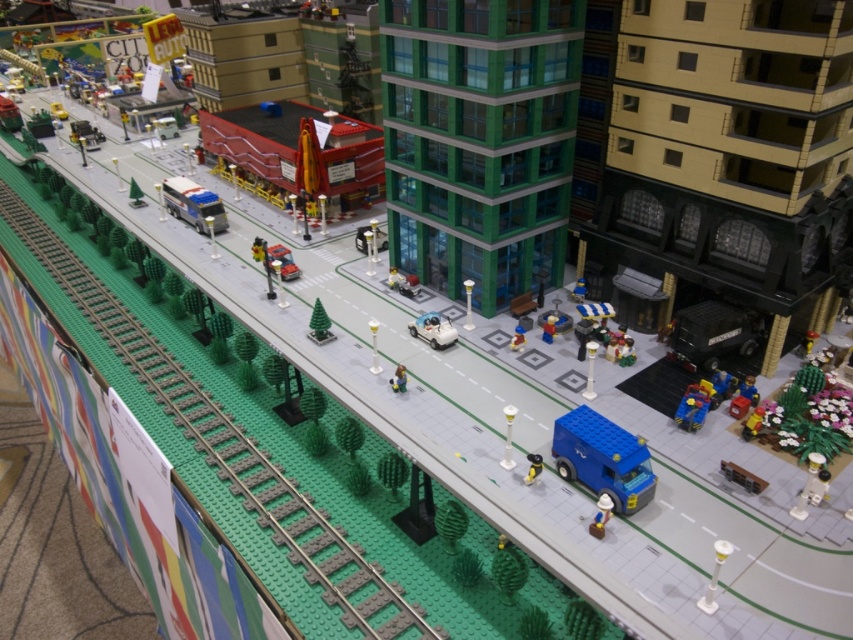
Can you confirm if shiny silver car at center is bigger than smooth gray figure at center?

Indeed, shiny silver car at center has a larger size compared to smooth gray figure at center.

Does shiny silver car at center appear on the right side of smooth gray figure at center?

Correct, you'll find shiny silver car at center to the right of smooth gray figure at center.

Between point (451, 330) and point (399, 374), which one is positioned behind?

Positioned behind is point (451, 330).

This screenshot has width=853, height=640. Identify the location of shiny silver car at center. (433, 330).

From the picture: Is green matte tree at center above brown matte hat at lower center?

Correct, green matte tree at center is located above brown matte hat at lower center.

Measure the distance between green matte tree at center and camera.

A distance of 20.69 meters exists between green matte tree at center and camera.

Locate an element on the screen. green matte tree at center is located at coordinates (318, 323).

Is blue plastic car at lower right bigger than shiny yellow toy car at center?

Correct, blue plastic car at lower right is larger in size than shiny yellow toy car at center.

Is blue plastic car at lower right positioned behind shiny yellow toy car at center?

Yes.

You are a GUI agent. You are given a task and a screenshot of the screen. Output one action in this format:
    pyautogui.click(x=<x>, y=<y>)
    Task: Click on the blue plastic car at lower right
    Image resolution: width=853 pixels, height=640 pixels.
    Given the screenshot: What is the action you would take?
    pyautogui.click(x=694, y=404)